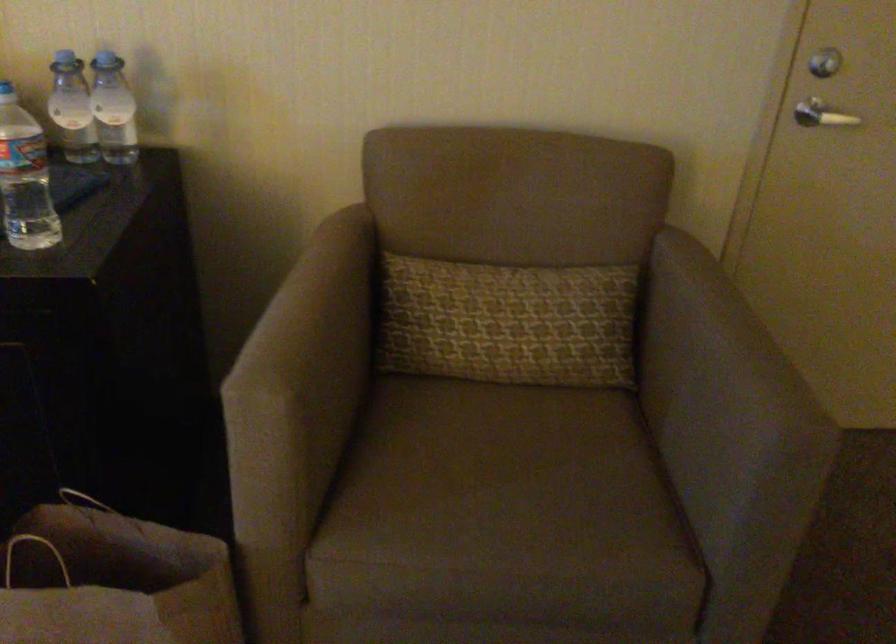
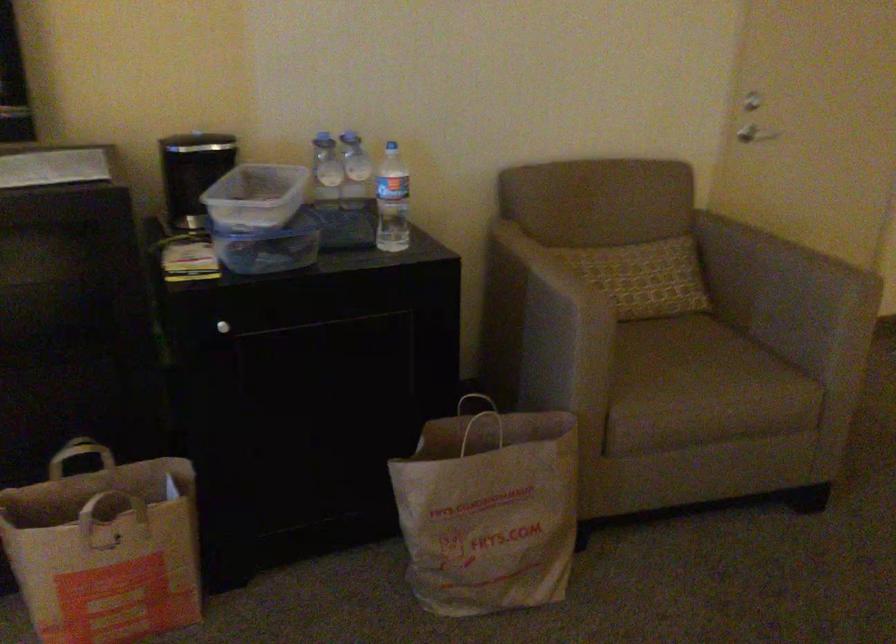
Locate, in the second image, the point that corresponds to (x=819, y=124) in the first image.

(760, 135)